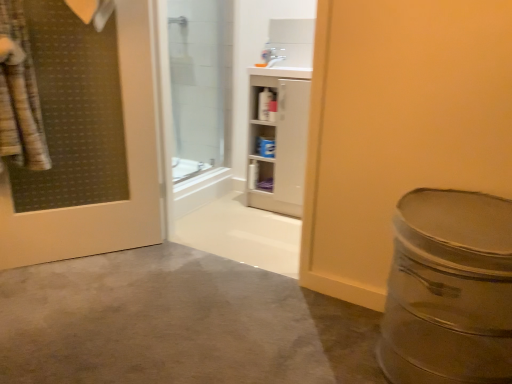
Question: Would you consider white glossy cabinet at upper center to be distant from transparent glass shower door at upper center?

Choices:
 (A) no
 (B) yes

Answer: (A)

Question: Can you confirm if white glossy cabinet at upper center is smaller than transparent glass shower door at upper center?

Choices:
 (A) no
 (B) yes

Answer: (B)

Question: Is white glossy cabinet at upper center aimed at transparent glass shower door at upper center?

Choices:
 (A) yes
 (B) no

Answer: (B)

Question: From the image's perspective, is white glossy cabinet at upper center beneath transparent glass shower door at upper center?

Choices:
 (A) yes
 (B) no

Answer: (A)

Question: From a real-world perspective, does white glossy cabinet at upper center sit lower than transparent glass shower door at upper center?

Choices:
 (A) no
 (B) yes

Answer: (B)

Question: Considering their positions, is white glossy cabinet at center located in front of or behind transparent glass shower door at upper center?

Choices:
 (A) behind
 (B) front

Answer: (A)

Question: Considering the positions of white glossy cabinet at center and transparent glass shower door at upper center in the image, is white glossy cabinet at center taller or shorter than transparent glass shower door at upper center?

Choices:
 (A) short
 (B) tall

Answer: (A)

Question: Based on their sizes in the image, would you say white glossy cabinet at center is bigger or smaller than transparent glass shower door at upper center?

Choices:
 (A) big
 (B) small

Answer: (A)

Question: From the image's perspective, is white glossy cabinet at center above or below transparent glass shower door at upper center?

Choices:
 (A) above
 (B) below

Answer: (B)

Question: Based on their positions, is white glossy cabinet at upper center located to the left or right of transparent glass shower door at upper center?

Choices:
 (A) right
 (B) left

Answer: (A)

Question: Relative to transparent glass shower door at upper center, is white glossy cabinet at upper center in front or behind?

Choices:
 (A) behind
 (B) front

Answer: (A)

Question: In terms of width, does white glossy cabinet at upper center look wider or thinner when compared to transparent glass shower door at upper center?

Choices:
 (A) thin
 (B) wide

Answer: (B)

Question: Is white glossy cabinet at upper center taller or shorter than transparent glass shower door at upper center?

Choices:
 (A) tall
 (B) short

Answer: (B)

Question: Does point (177, 190) appear closer or farther from the camera than point (261, 119)?

Choices:
 (A) closer
 (B) farther

Answer: (B)

Question: In terms of width, does transparent glass shower door at upper center look wider or thinner when compared to white glossy cabinet at upper center?

Choices:
 (A) wide
 (B) thin

Answer: (B)